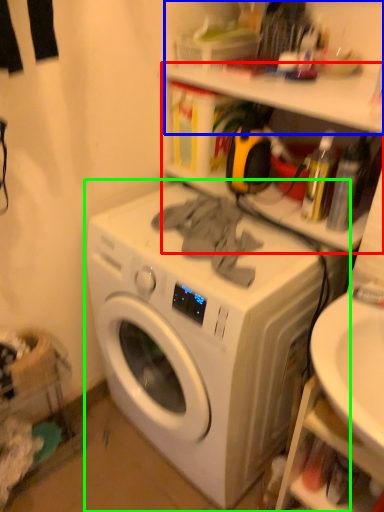
Question: Which is nearer to the shelf (highlighted by a red box)? shelf (highlighted by a blue box) or washing machine (highlighted by a green box).

Choices:
 (A) shelf
 (B) washing machine

Answer: (A)